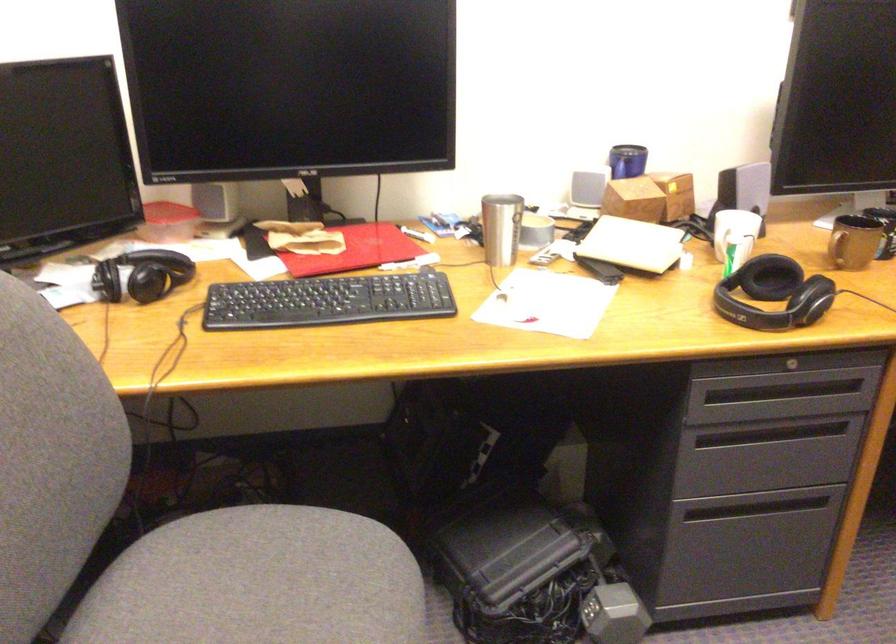
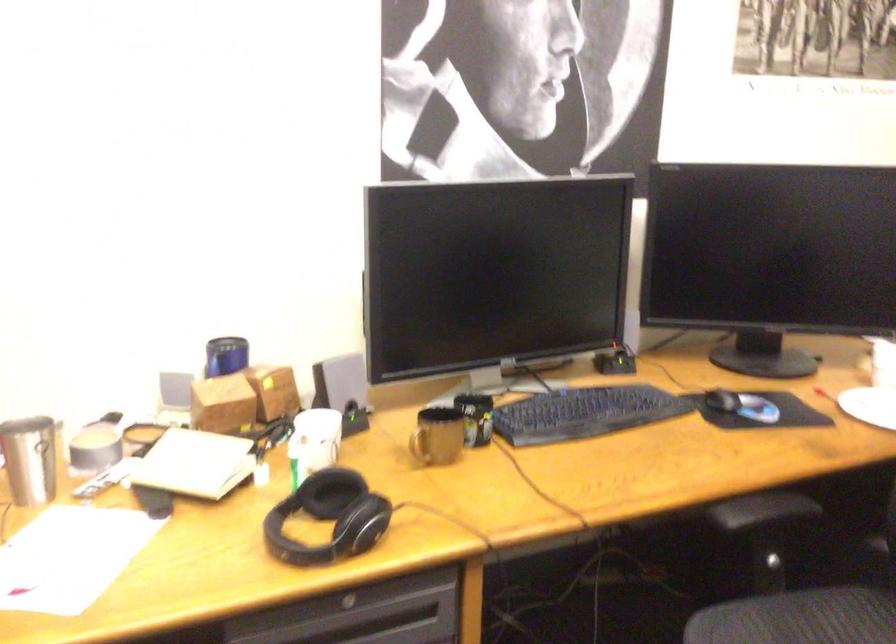
Locate, in the second image, the point that corresponds to (785,362) in the first image.

(347, 603)